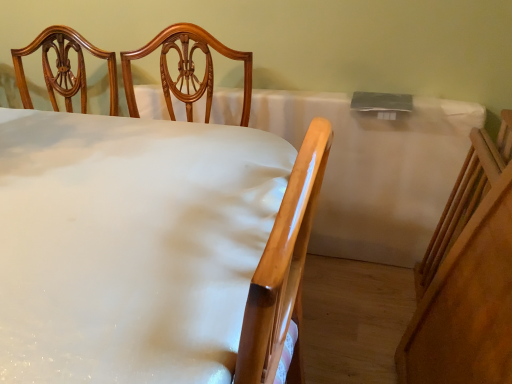
Based on the photo, in order to face white glossy bed at center, should I rotate leftwards or rightwards?

It's best to rotate left around 27.507 degrees.

Find the location of a particular element. Image resolution: width=512 pixels, height=384 pixels. white glossy bed at center is located at coordinates (151, 248).

The width and height of the screenshot is (512, 384). What do you see at coordinates (151, 248) in the screenshot?
I see `white glossy bed at center` at bounding box center [151, 248].

You are a GUI agent. You are given a task and a screenshot of the screen. Output one action in this format:
    pyautogui.click(x=<x>, y=<y>)
    Task: Click on the white matte tablecloth at center
    This screenshot has height=384, width=512.
    Given the screenshot: What is the action you would take?
    pyautogui.click(x=376, y=170)

This screenshot has width=512, height=384. Describe the element at coordinates (376, 170) in the screenshot. I see `white matte tablecloth at center` at that location.

Where is `white glossy bed at center`? white glossy bed at center is located at coordinates (151, 248).

Considering the relative positions of white glossy bed at center and white matte tablecloth at center in the image provided, is white glossy bed at center to the right of white matte tablecloth at center from the viewer's perspective?

No, white glossy bed at center is not to the right of white matte tablecloth at center.

Is white glossy bed at center behind white matte tablecloth at center?

No, it is not.

Considering the positions of point (285, 174) and point (398, 219), is point (285, 174) closer or farther from the camera than point (398, 219)?

Clearly, point (285, 174) is closer to the camera than point (398, 219).

From the image's perspective, which object appears higher, white glossy bed at center or white matte tablecloth at center?

white matte tablecloth at center.

From a real-world perspective, is white glossy bed at center below white matte tablecloth at center?

No, from a real-world perspective, white glossy bed at center is not beneath white matte tablecloth at center.

Considering the relative sizes of white glossy bed at center and white matte tablecloth at center in the image provided, is white glossy bed at center wider than white matte tablecloth at center?

Correct, the width of white glossy bed at center exceeds that of white matte tablecloth at center.

Can you confirm if white glossy bed at center is shorter than white matte tablecloth at center?

In fact, white glossy bed at center may be taller than white matte tablecloth at center.

Who is bigger, white glossy bed at center or white matte tablecloth at center?

Bigger between the two is white glossy bed at center.

Is white matte tablecloth at center surrounded by white glossy bed at center?

Actually, white matte tablecloth at center is outside white glossy bed at center.

Is white glossy bed at center placed right next to white matte tablecloth at center?

No, white glossy bed at center is not next to white matte tablecloth at center.

Is white glossy bed at center oriented towards white matte tablecloth at center?

No, white glossy bed at center is not facing towards white matte tablecloth at center.

How many degrees apart are the facing directions of white glossy bed at center and white matte tablecloth at center?

There is a 87.5-degree angle between the facing directions of white glossy bed at center and white matte tablecloth at center.

The width and height of the screenshot is (512, 384). I want to click on tablecloth on the right of white glossy bed at center, so click(376, 170).

Between white matte tablecloth at center and white glossy bed at center, which one appears on the left side from the viewer's perspective?

Positioned to the left is white glossy bed at center.

Is white matte tablecloth at center positioned in front of white glossy bed at center?

No, it is not.

Does point (342, 220) appear closer or farther from the camera than point (149, 348)?

Clearly, point (342, 220) is more distant from the camera than point (149, 348).

From the image's perspective, is white matte tablecloth at center above or below white glossy bed at center?

white matte tablecloth at center is situated higher than white glossy bed at center in the image.

From a real-world perspective, who is located higher, white matte tablecloth at center or white glossy bed at center?

white glossy bed at center, from a real-world perspective.

Considering the relative sizes of white matte tablecloth at center and white glossy bed at center in the image provided, is white matte tablecloth at center wider than white glossy bed at center?

Incorrect, the width of white matte tablecloth at center does not surpass that of white glossy bed at center.

Who is shorter, white matte tablecloth at center or white glossy bed at center?

white matte tablecloth at center.

Is white matte tablecloth at center bigger or smaller than white glossy bed at center?

Considering their sizes, white matte tablecloth at center takes up less space than white glossy bed at center.

Is white glossy bed at center located within white matte tablecloth at center?

No.

Would you say white matte tablecloth at center is a long distance from white glossy bed at center?

white matte tablecloth at center is actually quite close to white glossy bed at center.

Is white matte tablecloth at center aimed at white glossy bed at center?

Yes, white matte tablecloth at center is oriented towards white glossy bed at center.

Can you tell me how much white matte tablecloth at center and white glossy bed at center differ in facing direction?

87.5 degrees.

You are a GUI agent. You are given a task and a screenshot of the screen. Output one action in this format:
    pyautogui.click(x=<x>, y=<y>)
    Task: Click on the tablecloth behind the white glossy bed at center
    The image size is (512, 384).
    Given the screenshot: What is the action you would take?
    pyautogui.click(x=376, y=170)

You are a GUI agent. You are given a task and a screenshot of the screen. Output one action in this format:
    pyautogui.click(x=<x>, y=<y>)
    Task: Click on the tablecloth that is behind the white glossy bed at center
    
    Given the screenshot: What is the action you would take?
    pyautogui.click(x=376, y=170)

Locate an element on the screen. The image size is (512, 384). tablecloth that is under the white glossy bed at center (from a real-world perspective) is located at coordinates (376, 170).